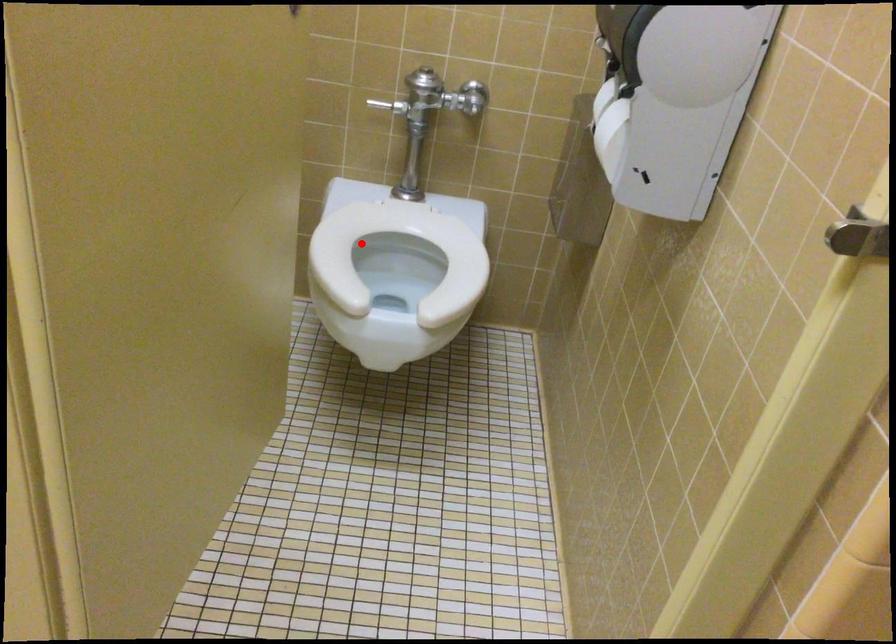
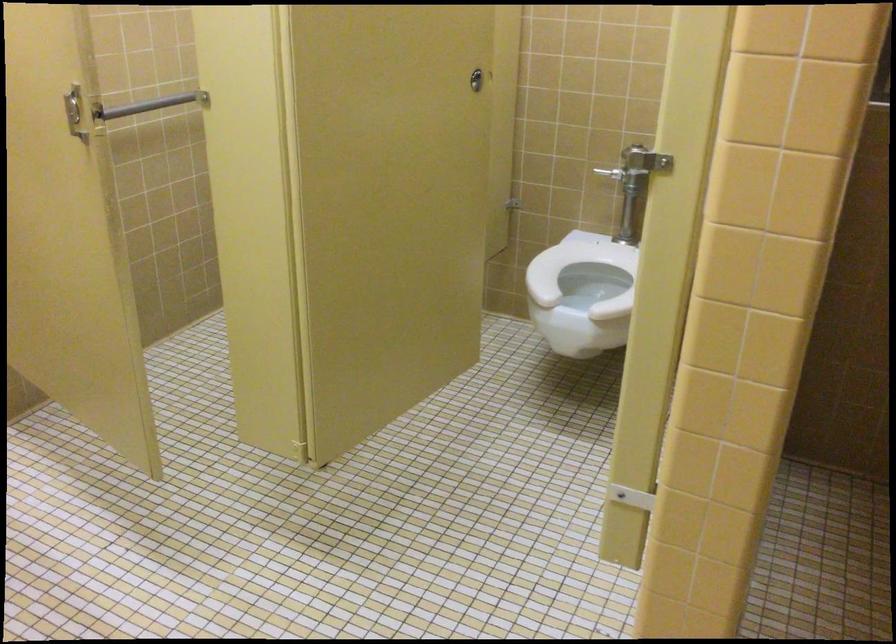
Locate, in the second image, the point that corresponds to the highlighted location in the first image.

(578, 268)